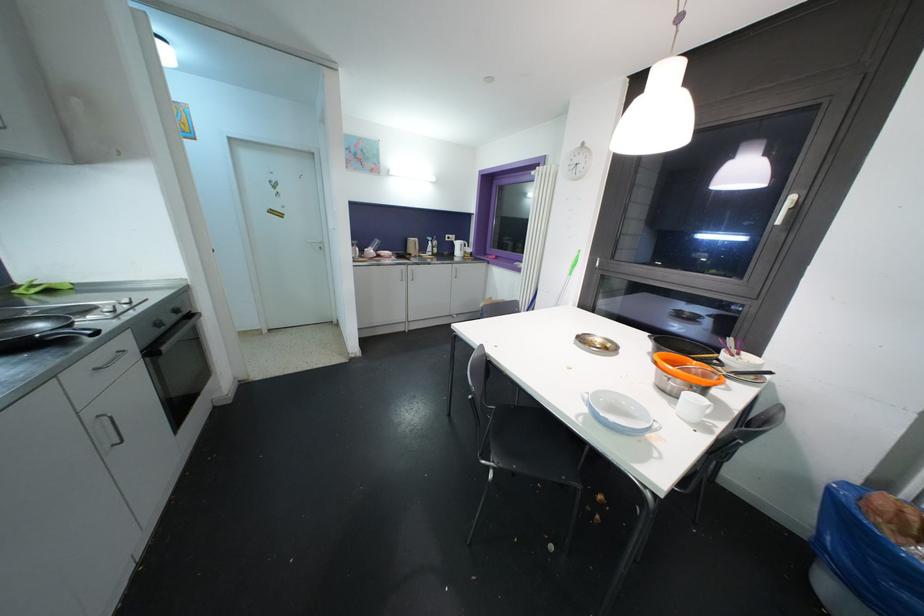
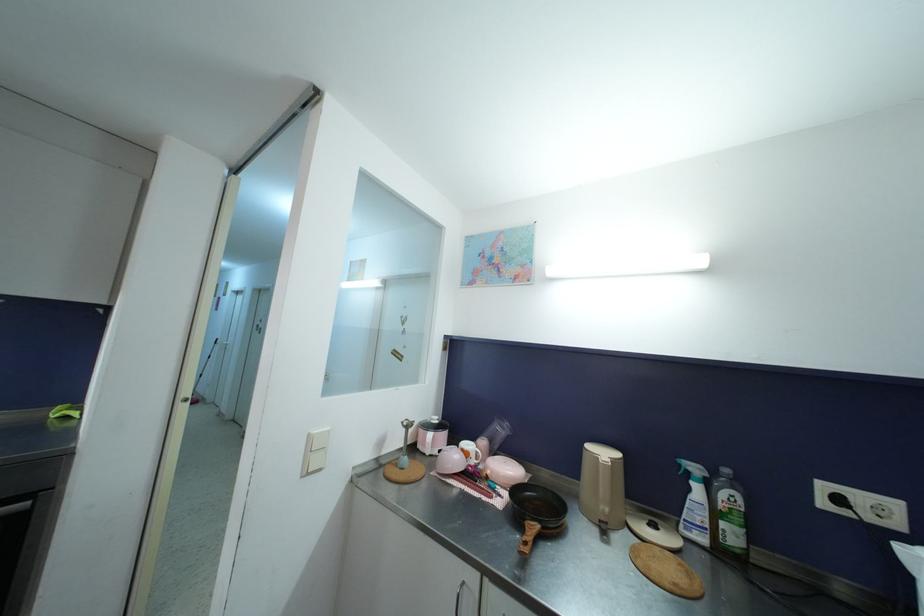
In the second image, find the point that corresponds to point 432,241 in the first image.

(699, 472)